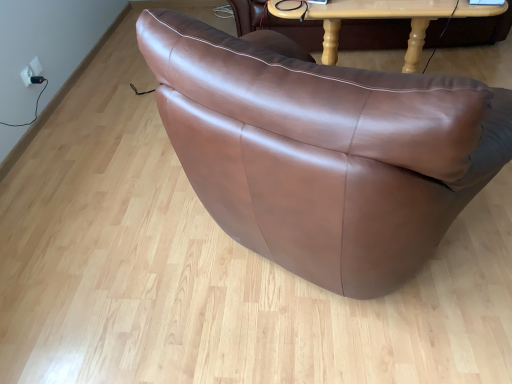
Question: Is point (398, 13) closer or farther from the camera than point (24, 76)?

Choices:
 (A) farther
 (B) closer

Answer: (B)

Question: Considering the relative positions of light brown wooden table at upper center and white plastic electric outlet at upper left in the image provided, is light brown wooden table at upper center to the left or to the right of white plastic electric outlet at upper left?

Choices:
 (A) right
 (B) left

Answer: (A)

Question: Considering the positions of light brown wooden table at upper center and white plastic electric outlet at upper left in the image, is light brown wooden table at upper center bigger or smaller than white plastic electric outlet at upper left?

Choices:
 (A) small
 (B) big

Answer: (B)

Question: Which is correct: white plastic electric outlet at upper left is inside light brown wooden table at upper center, or outside of it?

Choices:
 (A) outside
 (B) inside

Answer: (A)

Question: From the image's perspective, relative to light brown wooden table at upper center, is white plastic electric outlet at upper left above or below?

Choices:
 (A) below
 (B) above

Answer: (A)

Question: Considering the positions of white plastic electric outlet at upper left and light brown wooden table at upper center in the image, is white plastic electric outlet at upper left bigger or smaller than light brown wooden table at upper center?

Choices:
 (A) small
 (B) big

Answer: (A)

Question: From a real-world perspective, relative to light brown wooden table at upper center, is white plastic electric outlet at upper left vertically above or below?

Choices:
 (A) above
 (B) below

Answer: (B)